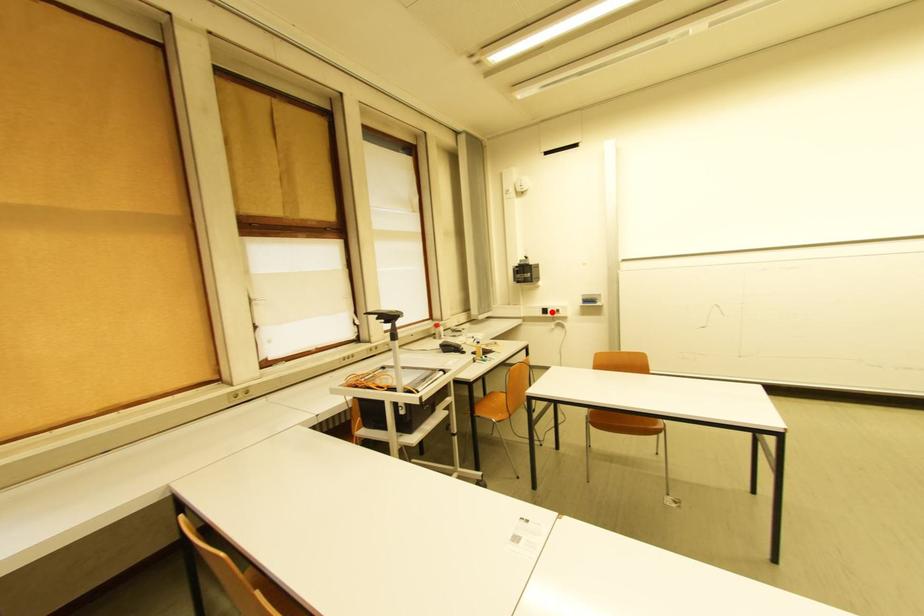
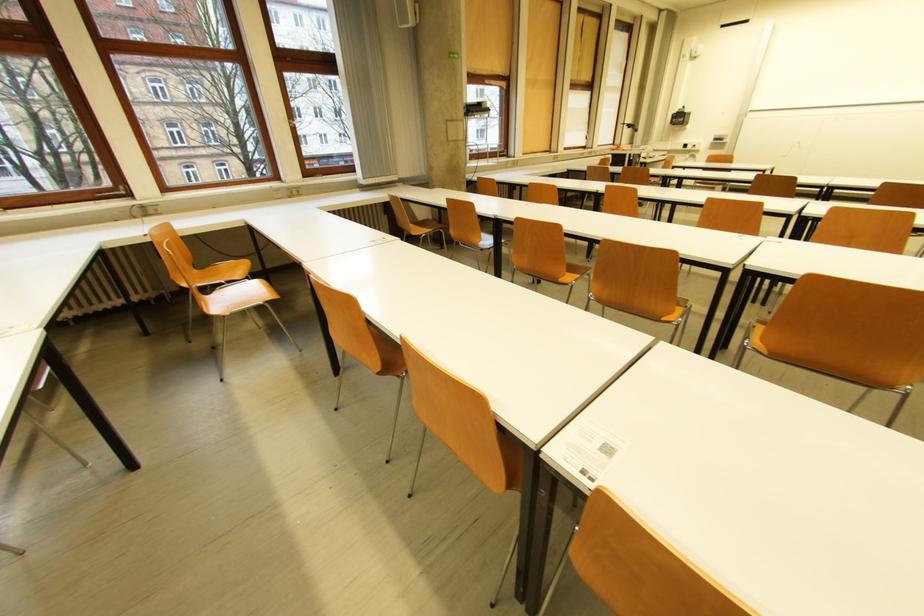
Question: I am providing you with two images of the same scene from different viewpoints. A red point is shown in image1. For the corresponding object point in image2, is it positioned nearer or farther from the camera?

Choices:
 (A) Nearer
 (B) Farther

Answer: (A)